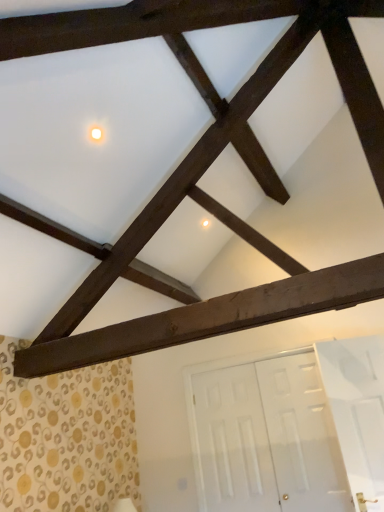
Question: Is point (97, 139) closer or farther from the camera than point (370, 288)?

Choices:
 (A) farther
 (B) closer

Answer: (A)

Question: Is white glossy light at upper center inside or outside of dark brown wood at center?

Choices:
 (A) outside
 (B) inside

Answer: (A)

Question: Which of these objects is positioned closest to the white glossy door at lower right?

Choices:
 (A) dark brown wood at center
 (B) white glossy light at upper center

Answer: (A)

Question: Which of these objects is positioned farthest from the dark brown wood at center?

Choices:
 (A) white glossy door at lower right
 (B) white glossy light at upper center

Answer: (A)